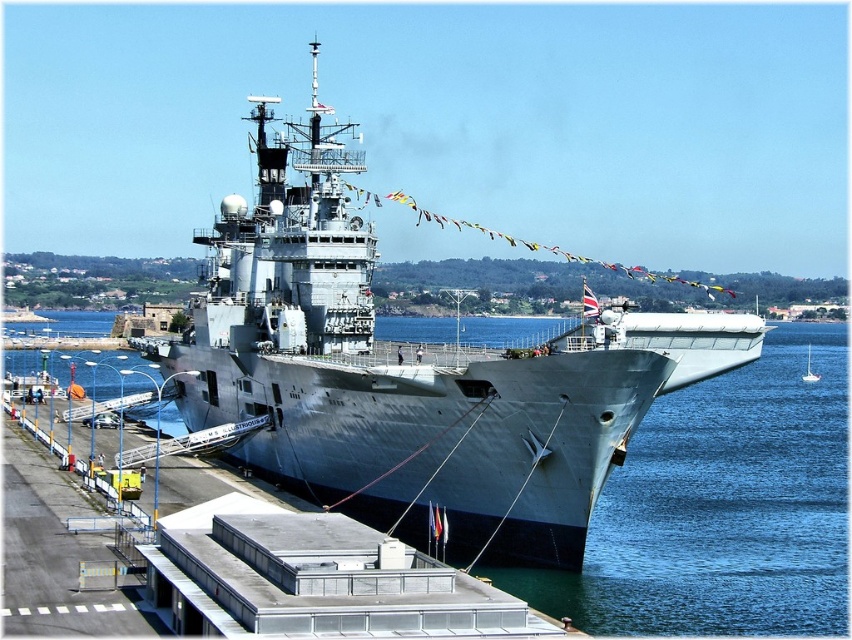
You are standing on the pier and looking at the gray metallic ship at center and the gray metallic water at center. Which object is nearer to you?

The gray metallic ship at center is closer to the viewer than the gray metallic water at center, so the gray metallic ship at center is nearer to you.

You are a harbor pilot who needs to dock the gray metallic ship at center. The harbor requires that the ship must be positioned at point 0.584, 0.482 to align with the docking platform. Is the ship currently in the correct position?

The gray metallic ship at center is already positioned at point (410,372), so it is correctly aligned with the docking platform.